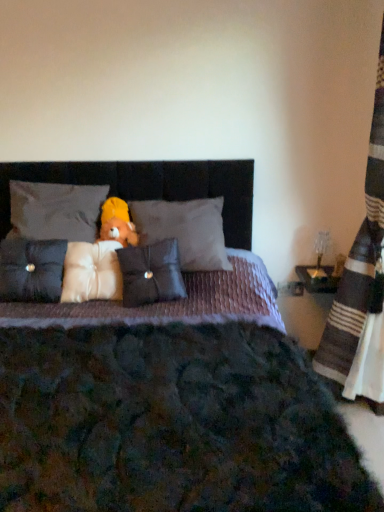
Question: Do you think velvet gray pillow at center, which is the 5th pillow from left to right, is within white soft pillow at center, marked as the third pillow in a right-to-left arrangement, or outside of it?

Choices:
 (A) outside
 (B) inside

Answer: (A)

Question: Is velvet gray pillow at center, which is the 5th pillow from left to right, wider or thinner than white soft pillow at center, marked as the third pillow in a right-to-left arrangement?

Choices:
 (A) wide
 (B) thin

Answer: (A)

Question: Based on their relative distances, which object is nearer to the white satin pillow at upper center, positioned as the second pillow in left-to-right order?

Choices:
 (A) satin gray pillow at center, the second pillow viewed from the right
 (B) yellow plush bear at center
 (C) velvet purple bed at center
 (D) striped fabric curtain at right
 (E) translucent glass table lamp at right

Answer: (B)

Question: Estimate the real-world distances between objects in this image. Which object is closer to the velvet gray pillow at center, which is the 5th pillow from left to right?

Choices:
 (A) striped fabric curtain at right
 (B) white satin pillow at upper center, positioned as the second pillow in left-to-right order
 (C) velvet purple bed at center
 (D) satin gray pillow at center, placed as the 4th pillow when sorted from left to right
 (E) white soft pillow at center, the third pillow in the left-to-right sequence

Answer: (D)